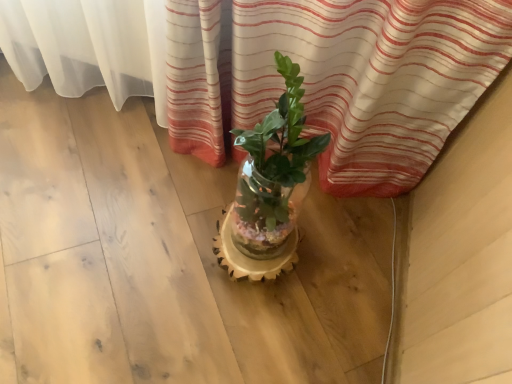
Question: In terms of height, does translucent glass vase at center look taller or shorter compared to translucent glass vase at center?

Choices:
 (A) short
 (B) tall

Answer: (A)

Question: Looking at their shapes, would you say translucent glass vase at center is wider or thinner than translucent glass vase at center?

Choices:
 (A) thin
 (B) wide

Answer: (B)

Question: Would you say translucent glass vase at center is to the left or to the right of translucent glass vase at center in the picture?

Choices:
 (A) right
 (B) left

Answer: (B)

Question: Considering the relative positions of translucent glass vase at center and translucent glass vase at center in the image provided, is translucent glass vase at center to the left or to the right of translucent glass vase at center?

Choices:
 (A) right
 (B) left

Answer: (A)

Question: Considering the positions of translucent glass vase at center and translucent glass vase at center in the image, is translucent glass vase at center taller or shorter than translucent glass vase at center?

Choices:
 (A) tall
 (B) short

Answer: (A)

Question: Considering the positions of translucent glass vase at center and translucent glass vase at center in the image, is translucent glass vase at center wider or thinner than translucent glass vase at center?

Choices:
 (A) wide
 (B) thin

Answer: (B)

Question: In the image, is translucent glass vase at center positioned in front of or behind translucent glass vase at center?

Choices:
 (A) behind
 (B) front

Answer: (B)